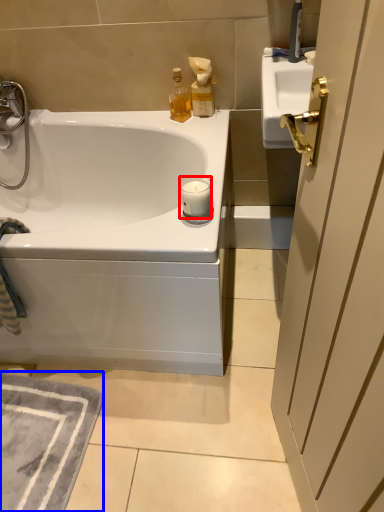
Question: Which object is further to the camera taking this photo, candle (highlighted by a red box) or bath mat (highlighted by a blue box)?

Choices:
 (A) candle
 (B) bath mat

Answer: (B)